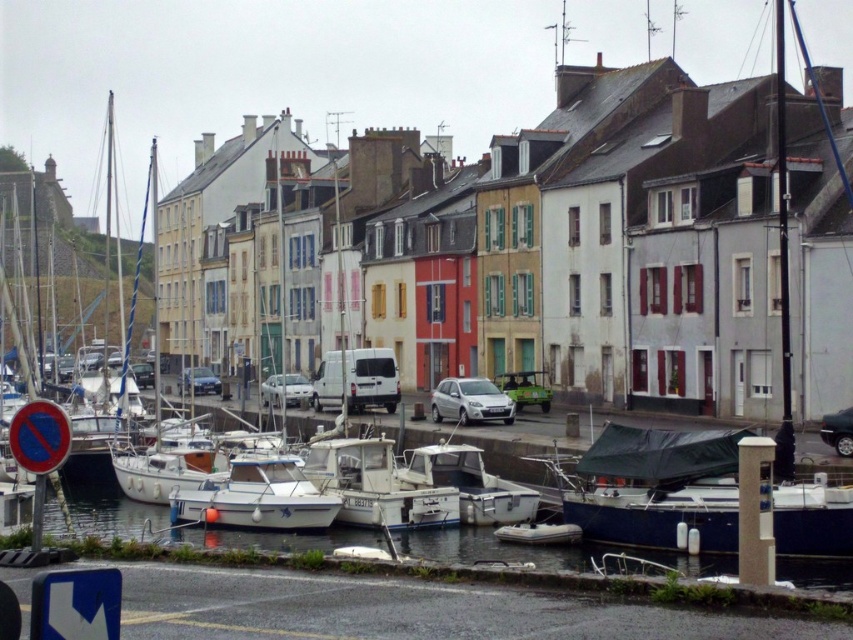
You are a delivery person needing to park your car, which is the same size as the green matte car at center, in this area. There is a space between the white matte boats at lower center and the road. Will your car fit in that space?

The white matte boats at lower center are wider than the green matte car at center. Since the space between the boats and the road is likely sized for the boats, your car, being narrower, should fit comfortably.

You are a delivery driver who needs to park your green matte car at center in a parking spot that can only accommodate vehicles narrower than the white matte boat at center. Is your car too wide for the parking spot?

The white matte boat at center is wider than the green matte car at center. Since the parking spot requires vehicles narrower than the boat, the green matte car at center is narrow enough to fit.